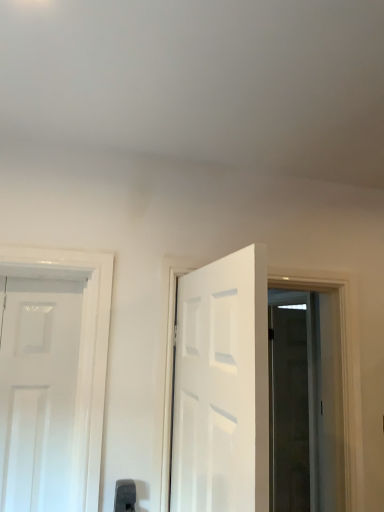
Question: Can you confirm if white glossy door at center is bigger than black plastic door handle at lower center?

Choices:
 (A) no
 (B) yes

Answer: (B)

Question: Is the depth of white glossy door at center greater than that of black plastic door handle at lower center?

Choices:
 (A) yes
 (B) no

Answer: (B)

Question: Can you confirm if white glossy door at center is smaller than black plastic door handle at lower center?

Choices:
 (A) no
 (B) yes

Answer: (A)

Question: Considering the relative sizes of white glossy door at center and black plastic door handle at lower center in the image provided, is white glossy door at center taller than black plastic door handle at lower center?

Choices:
 (A) yes
 (B) no

Answer: (A)

Question: Is white glossy door at center oriented away from black plastic door handle at lower center?

Choices:
 (A) yes
 (B) no

Answer: (A)

Question: In the image, is transparent glass door at right positioned in front of or behind white glossy door at center?

Choices:
 (A) front
 (B) behind

Answer: (B)

Question: From the image's perspective, is transparent glass door at right above or below white glossy door at center?

Choices:
 (A) above
 (B) below

Answer: (B)

Question: Is transparent glass door at right to the left or to the right of white glossy door at center in the image?

Choices:
 (A) left
 (B) right

Answer: (B)

Question: From their relative heights in the image, would you say transparent glass door at right is taller or shorter than white glossy door at center?

Choices:
 (A) tall
 (B) short

Answer: (A)

Question: From a real-world perspective, is black plastic door handle at lower center physically located above or below white glossy door at center?

Choices:
 (A) below
 (B) above

Answer: (A)

Question: From the image's perspective, is black plastic door handle at lower center above or below white glossy door at center?

Choices:
 (A) below
 (B) above

Answer: (A)

Question: From their relative heights in the image, would you say black plastic door handle at lower center is taller or shorter than white glossy door at center?

Choices:
 (A) tall
 (B) short

Answer: (B)

Question: Is point (132, 501) positioned closer to the camera than point (185, 410)?

Choices:
 (A) closer
 (B) farther

Answer: (B)

Question: Considering the relative positions of black plastic door handle at lower center and transparent glass door at right in the image provided, is black plastic door handle at lower center to the left or to the right of transparent glass door at right?

Choices:
 (A) left
 (B) right

Answer: (A)

Question: From a real-world perspective, is black plastic door handle at lower center physically located above or below transparent glass door at right?

Choices:
 (A) below
 (B) above

Answer: (A)